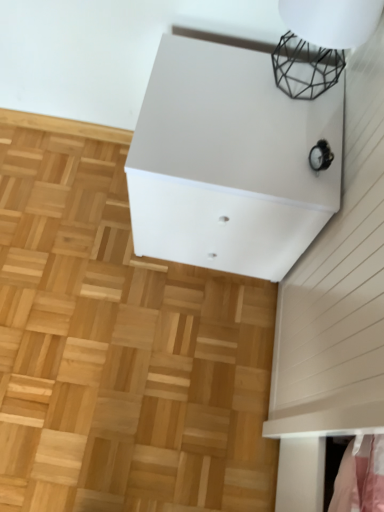
Question: In the image, is white matte cabinet at upper center positioned in front of or behind natural wood parquet floor at center?

Choices:
 (A) front
 (B) behind

Answer: (A)

Question: In the image, is white matte cabinet at upper center on the left side or the right side of natural wood parquet floor at center?

Choices:
 (A) right
 (B) left

Answer: (A)

Question: Which of these objects is positioned closest to the black wire mesh at upper right?

Choices:
 (A) natural wood parquet floor at center
 (B) white matte cabinet at upper center

Answer: (B)

Question: Estimate the real-world distances between objects in this image. Which object is farther from the natural wood parquet floor at center?

Choices:
 (A) black wire mesh at upper right
 (B) white matte cabinet at upper center

Answer: (A)